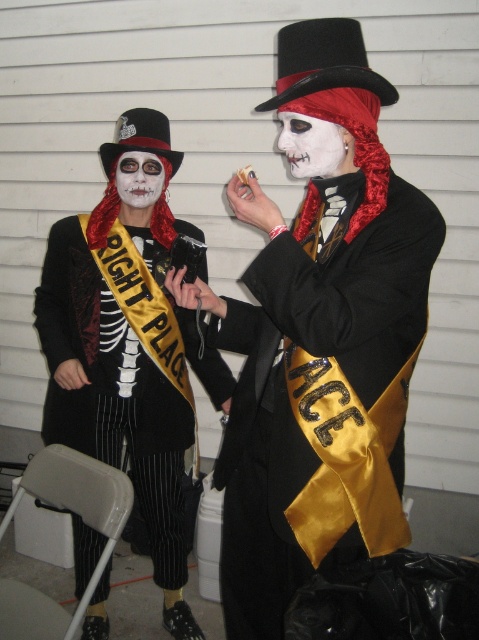
Question: Observing the image, what is the correct spatial positioning of matte black coat at center in reference to white matte face at center?

Choices:
 (A) above
 (B) below

Answer: (B)

Question: Is white matte face at center bigger than white matte face paint at center?

Choices:
 (A) yes
 (B) no

Answer: (A)

Question: Does matte black coat at center appear on the left side of white matte face at center?

Choices:
 (A) yes
 (B) no

Answer: (A)

Question: Which is nearer to the matte black coat at center?

Choices:
 (A) white matte face paint at center
 (B) white matte face at center

Answer: (A)

Question: Among these objects, which one is farthest from the camera?

Choices:
 (A) white matte face at center
 (B) white matte face paint at center

Answer: (B)

Question: Estimate the real-world distances between objects in this image. Which object is closer to the white matte face paint at center?

Choices:
 (A) matte black coat at center
 (B) white matte face at center

Answer: (A)